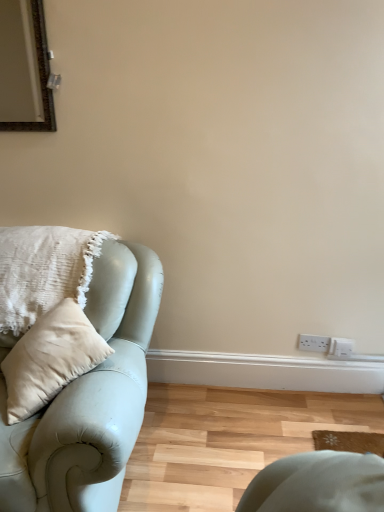
Question: Considering the relative sizes of white plastic electric outlet at lower right and white textured cushion at left in the image provided, is white plastic electric outlet at lower right bigger than white textured cushion at left?

Choices:
 (A) yes
 (B) no

Answer: (B)

Question: Is white plastic electric outlet at lower right to the right of white textured cushion at left from the viewer's perspective?

Choices:
 (A) yes
 (B) no

Answer: (A)

Question: Is white plastic electric outlet at lower right wider than white textured cushion at left?

Choices:
 (A) no
 (B) yes

Answer: (A)

Question: Considering the relative sizes of white plastic electric outlet at lower right and white textured cushion at left in the image provided, is white plastic electric outlet at lower right smaller than white textured cushion at left?

Choices:
 (A) no
 (B) yes

Answer: (B)

Question: Is white plastic electric outlet at lower right oriented towards white textured cushion at left?

Choices:
 (A) yes
 (B) no

Answer: (B)

Question: In terms of size, does white textured cushion at left appear bigger or smaller than white plastic electric outlet at lower right?

Choices:
 (A) small
 (B) big

Answer: (B)

Question: Relative to white plastic electric outlet at lower right, is white textured cushion at left in front or behind?

Choices:
 (A) behind
 (B) front

Answer: (B)

Question: Is white textured cushion at left spatially inside white plastic electric outlet at lower right, or outside of it?

Choices:
 (A) outside
 (B) inside

Answer: (A)

Question: In the image, is white textured cushion at left on the left side or the right side of white plastic electric outlet at lower right?

Choices:
 (A) right
 (B) left

Answer: (B)

Question: From a real-world perspective, is white plastic electric outlet at lower right above or below sage green leather studio couch at left?

Choices:
 (A) below
 (B) above

Answer: (A)

Question: In the image, is white plastic electric outlet at lower right on the left side or the right side of sage green leather studio couch at left?

Choices:
 (A) right
 (B) left

Answer: (A)

Question: From the image's perspective, relative to sage green leather studio couch at left, is white plastic electric outlet at lower right above or below?

Choices:
 (A) below
 (B) above

Answer: (A)

Question: From their relative heights in the image, would you say white plastic electric outlet at lower right is taller or shorter than sage green leather studio couch at left?

Choices:
 (A) tall
 (B) short

Answer: (B)

Question: Considering the positions of sage green leather studio couch at left and white plastic electric outlet at lower right in the image, is sage green leather studio couch at left bigger or smaller than white plastic electric outlet at lower right?

Choices:
 (A) small
 (B) big

Answer: (B)

Question: From a real-world perspective, is sage green leather studio couch at left physically located above or below white plastic electric outlet at lower right?

Choices:
 (A) above
 (B) below

Answer: (A)